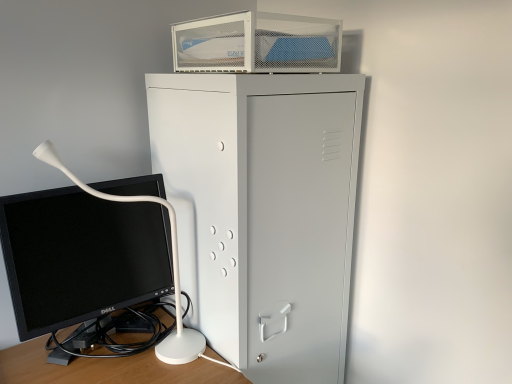
Question: Is black glossy computer monitor at lower left situated inside metallic gray cabinet at center or outside?

Choices:
 (A) inside
 (B) outside

Answer: (B)

Question: In terms of width, does black glossy computer monitor at lower left look wider or thinner when compared to metallic gray cabinet at center?

Choices:
 (A) thin
 (B) wide

Answer: (A)

Question: Estimate the real-world distances between objects in this image. Which object is closer to the black glossy computer monitor at lower left?

Choices:
 (A) metal mesh container at upper center
 (B) metallic gray cabinet at center

Answer: (B)

Question: Which object is the farthest from the black glossy computer monitor at lower left?

Choices:
 (A) metallic gray cabinet at center
 (B) metal mesh container at upper center

Answer: (B)